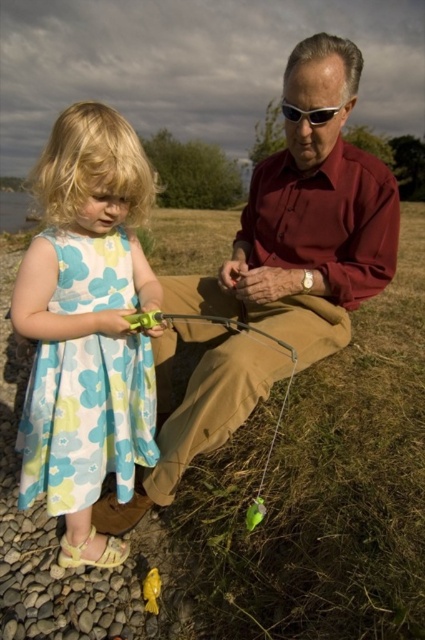
Question: Is matte brown trousers at center to the right of floral-patterned fabric dress at left from the viewer's perspective?

Choices:
 (A) no
 (B) yes

Answer: (B)

Question: Is the position of matte brown trousers at center more distant than that of floral-patterned fabric dress at left?

Choices:
 (A) yes
 (B) no

Answer: (A)

Question: Does matte brown trousers at center lie behind floral-patterned fabric dress at left?

Choices:
 (A) no
 (B) yes

Answer: (B)

Question: Among these objects, which one is nearest to the camera?

Choices:
 (A) floral-patterned fabric dress at left
 (B) matte brown trousers at center

Answer: (A)

Question: Which point appears closest to the camera in this image?

Choices:
 (A) (226, 288)
 (B) (147, 460)

Answer: (B)